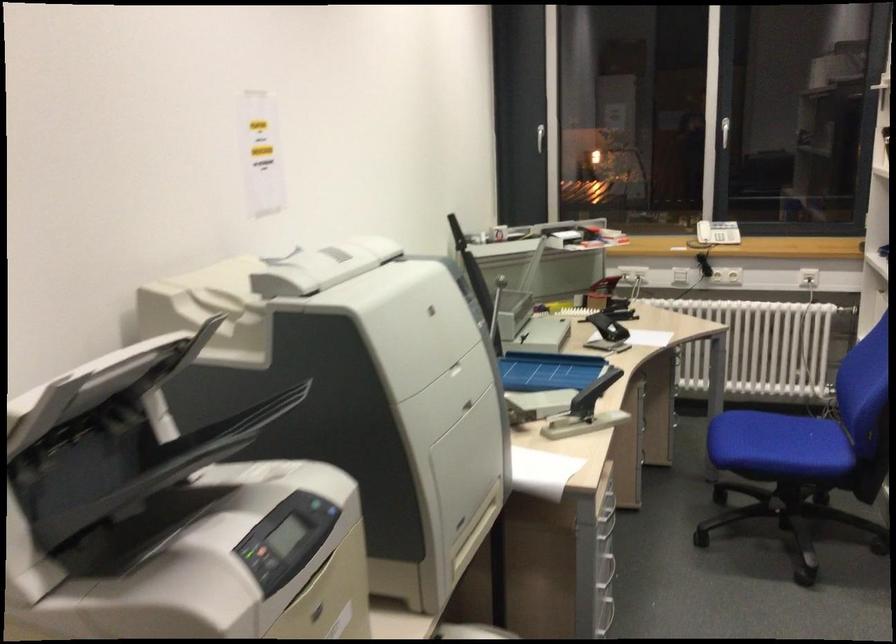
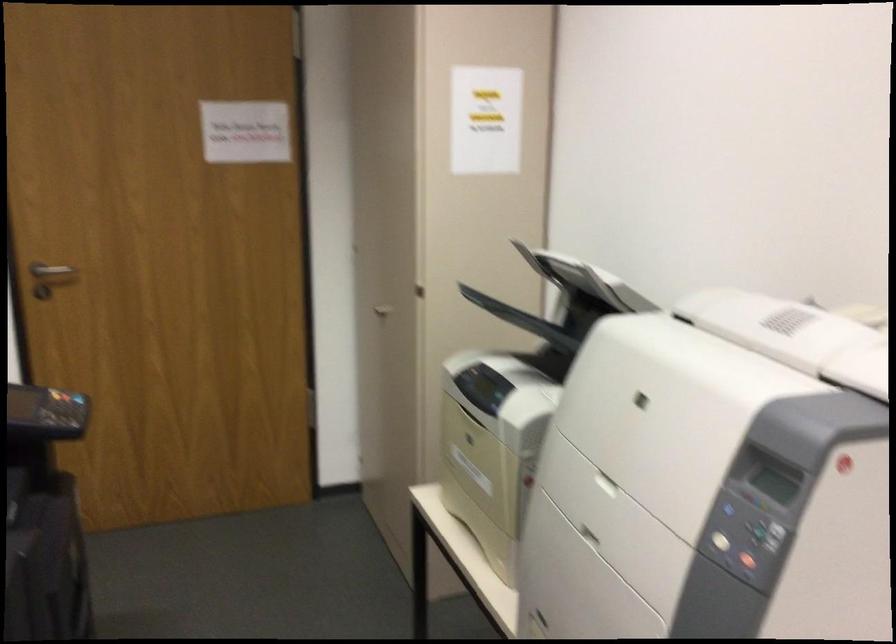
Locate, in the second image, the point that corresponds to the point at 453,337 in the first image.

(753, 553)